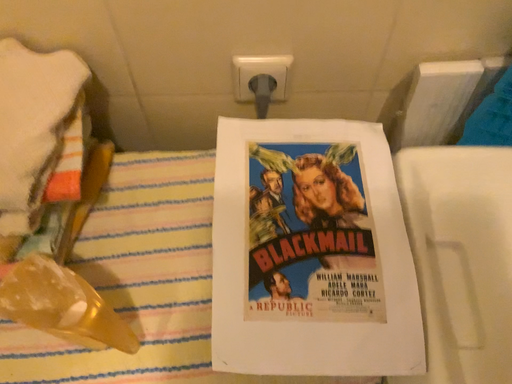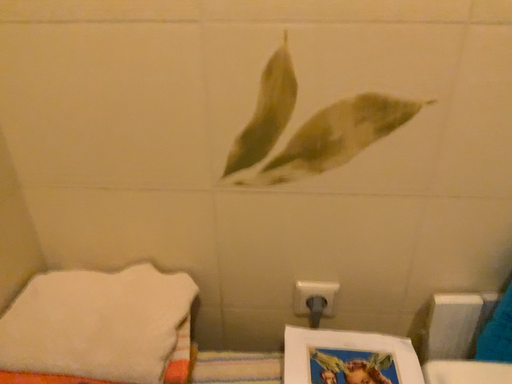
Question: How did the camera likely rotate when shooting the video?

Choices:
 (A) rotated upward
 (B) rotated downward

Answer: (A)